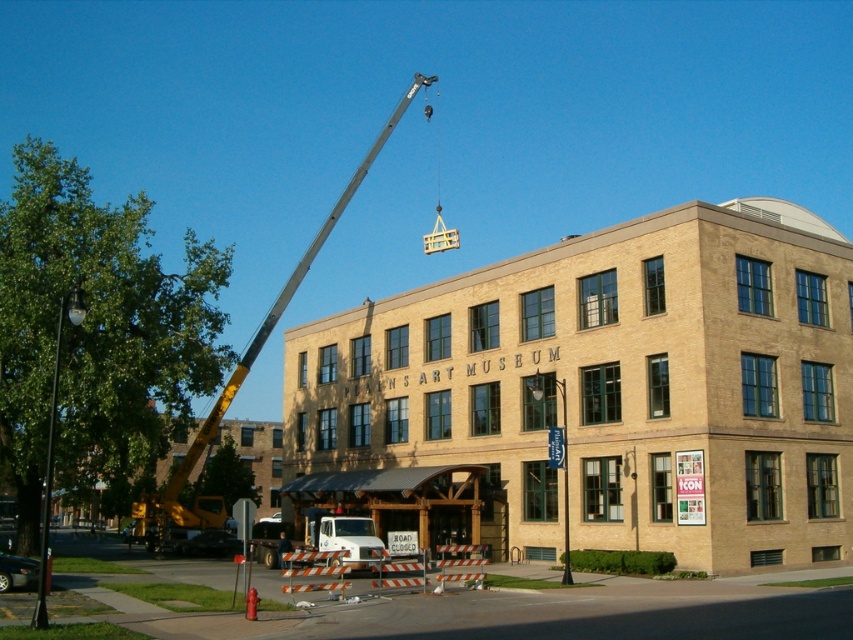
Question: Is beige brick building at center to the right of white plastic lift at center from the viewer's perspective?

Choices:
 (A) yes
 (B) no

Answer: (A)

Question: Does beige brick building at center come behind yellow metallic crane at upper left?

Choices:
 (A) yes
 (B) no

Answer: (B)

Question: Which of the following is the farthest from the observer?

Choices:
 (A) yellow metallic crane at upper left
 (B) beige brick building at center
 (C) white plastic lift at center

Answer: (A)

Question: Estimate the real-world distances between objects in this image. Which object is closer to the white plastic lift at center?

Choices:
 (A) beige brick building at center
 (B) yellow metallic crane at upper left

Answer: (A)

Question: Which of the following is the closest to the observer?

Choices:
 (A) (582, 284)
 (B) (396, 115)

Answer: (A)

Question: Can you confirm if yellow metallic crane at upper left is wider than white plastic lift at center?

Choices:
 (A) yes
 (B) no

Answer: (A)